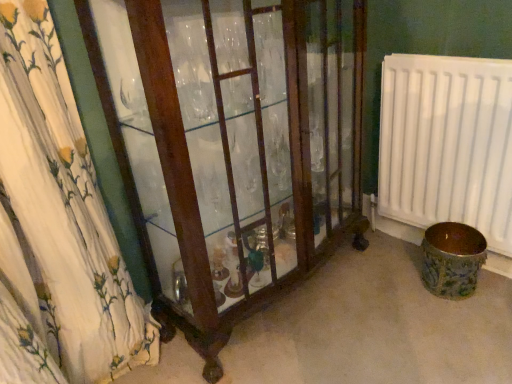
Question: Is brown ceramic vase at lower right directly adjacent to mahogany glass cabinet at left?

Choices:
 (A) no
 (B) yes

Answer: (A)

Question: Does brown ceramic vase at lower right appear on the left side of mahogany glass cabinet at left?

Choices:
 (A) yes
 (B) no

Answer: (B)

Question: Is brown ceramic vase at lower right taller than mahogany glass cabinet at left?

Choices:
 (A) yes
 (B) no

Answer: (B)

Question: Can you confirm if brown ceramic vase at lower right is smaller than mahogany glass cabinet at left?

Choices:
 (A) no
 (B) yes

Answer: (B)

Question: Is the position of brown ceramic vase at lower right more distant than that of mahogany glass cabinet at left?

Choices:
 (A) no
 (B) yes

Answer: (B)

Question: Is white plastic radiator at right wider or thinner than mahogany glass cabinet at left?

Choices:
 (A) wide
 (B) thin

Answer: (B)

Question: From the image's perspective, is white plastic radiator at right above or below mahogany glass cabinet at left?

Choices:
 (A) below
 (B) above

Answer: (B)

Question: Is white plastic radiator at right situated inside mahogany glass cabinet at left or outside?

Choices:
 (A) inside
 (B) outside

Answer: (B)

Question: Looking at the image, does white plastic radiator at right seem bigger or smaller compared to mahogany glass cabinet at left?

Choices:
 (A) small
 (B) big

Answer: (A)

Question: Is mahogany glass cabinet at left to the left or to the right of brown ceramic vase at lower right in the image?

Choices:
 (A) right
 (B) left

Answer: (B)

Question: Considering the positions of mahogany glass cabinet at left and brown ceramic vase at lower right in the image, is mahogany glass cabinet at left wider or thinner than brown ceramic vase at lower right?

Choices:
 (A) thin
 (B) wide

Answer: (B)

Question: From the image's perspective, relative to brown ceramic vase at lower right, is mahogany glass cabinet at left above or below?

Choices:
 (A) above
 (B) below

Answer: (A)

Question: Looking at the image, does mahogany glass cabinet at left seem bigger or smaller compared to brown ceramic vase at lower right?

Choices:
 (A) big
 (B) small

Answer: (A)

Question: Is mahogany glass cabinet at left bigger or smaller than white plastic radiator at right?

Choices:
 (A) big
 (B) small

Answer: (A)

Question: Is point (301, 276) closer or farther from the camera than point (403, 56)?

Choices:
 (A) closer
 (B) farther

Answer: (B)